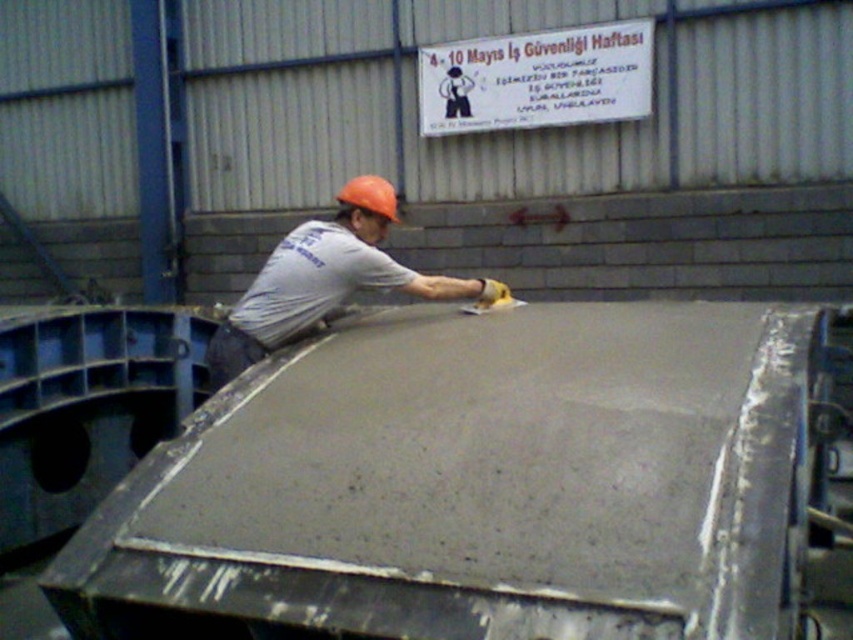
You are a safety inspector standing 6 feet away from the camera position. You need to check the smooth concrete at center. Can you reach it without moving closer?

The smooth concrete at center is 5.59 feet away from the camera. Since you are standing 6 feet away from the camera position, you are 1.49 feet away from the smooth concrete at center. Therefore, you can reach it without moving closer.

You are a construction inspector and need to measure two points on the concrete surface. The first point is at coordinate point[387,588] and the second is at point[296,308]. Which point is closer to your current position?

Point[387,588] is closer to the camera than point[296,308], so the first point is closer to your current position.

You are a construction worker who needs to place a safety sign at point (x=827, y=369). The sign is 1.2 meters wide. Can you walk to that point from your current position without the sign hitting anything? Explain your reasoning.

The point (x=827, y=369) is 3.57 meters away from the camera. Since the sign is 1.2 meters wide, you can safely walk to the point as long as there is enough space along the path. However, the scene description does not provide information about obstacles or the width of the path, so it is assumed that the area is clear for movement.